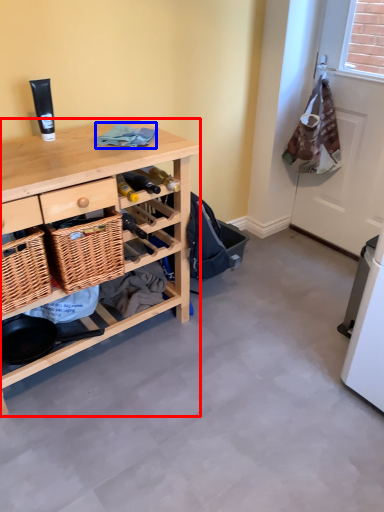
Question: Which object appears closest to the camera in this image, desk (highlighted by a red box) or clothing (highlighted by a blue box)?

Choices:
 (A) desk
 (B) clothing

Answer: (A)